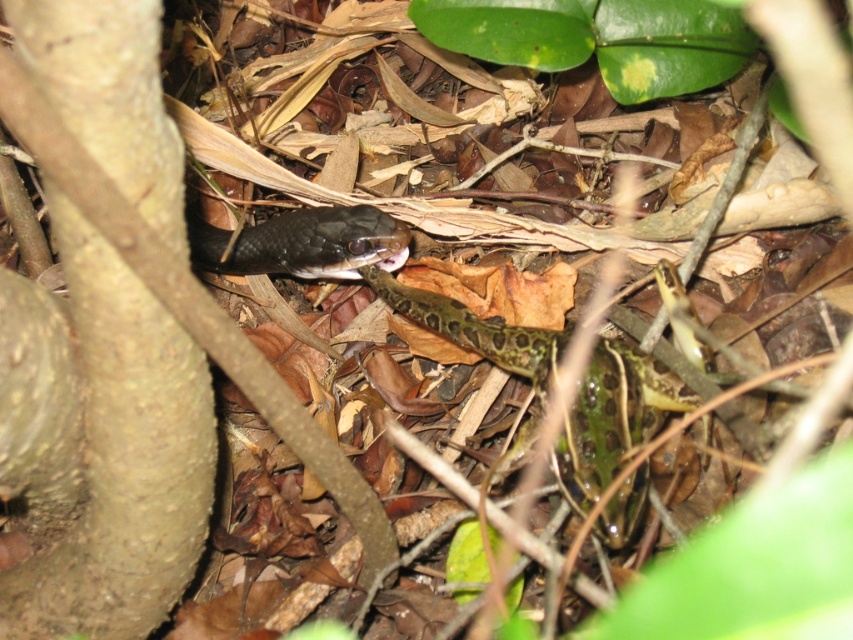
You are a hiker who wants to place a 10 cm wide rock between the smooth brown tree trunk at left and the shiny black snake at center. Based on their widths, will the rock fit between them?

The smooth brown tree trunk at left might be wider than shiny black snake at center, so the 10 cm wide rock may or may not fit between them depending on the exact width difference.

You are a hiker who has just spotted a smooth brown tree trunk at left in the forest. If you want to locate it precisely on a map with coordinates, what are its coordinates?

The smooth brown tree trunk at left is located at coordinates point (140, 340).